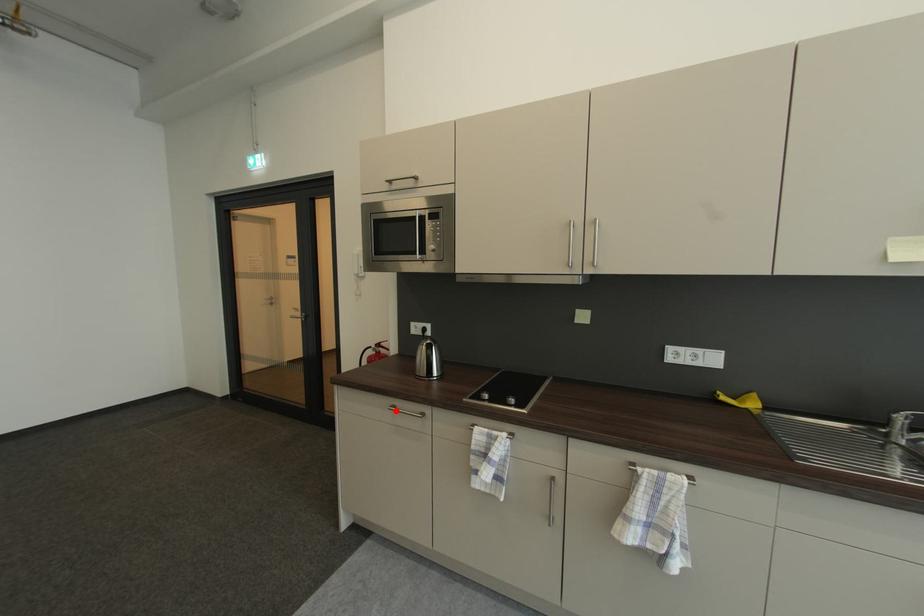
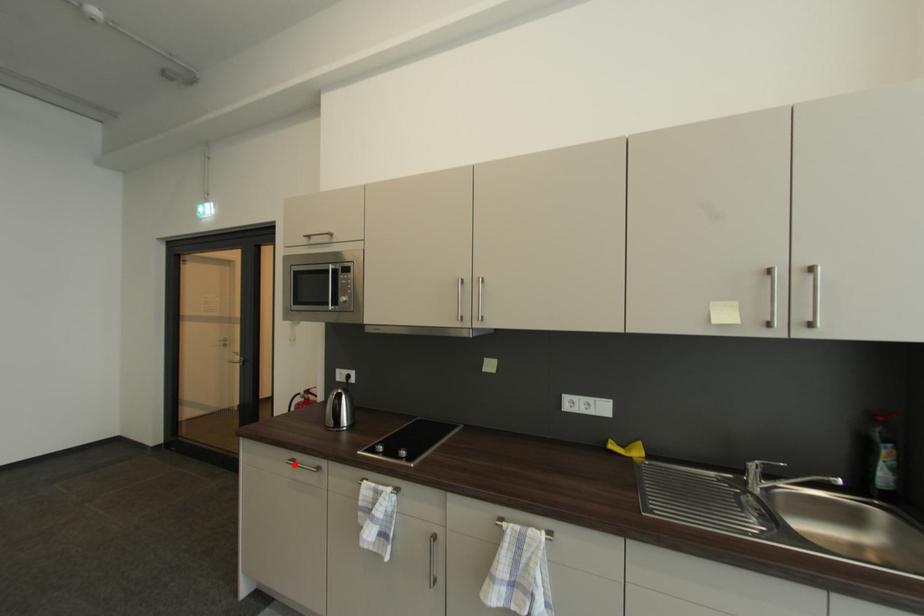
I am providing you with two images of the same scene from different viewpoints. A red point is marked on the first image and another point is marked on the second image. Are the points marked in image1 and image2 representing the same 3D position?

Yes